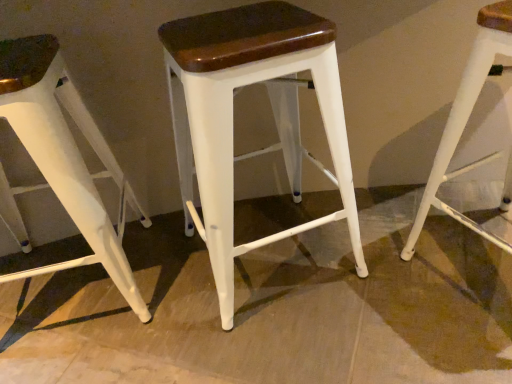
Question: Does white matte stool at center, the 2th stool from the left, contain white matte stool at left, placed as the 3th stool when sorted from right to left?

Choices:
 (A) yes
 (B) no

Answer: (B)

Question: Is the position of white matte stool at center, placed as the 2th stool when sorted from right to left, more distant than that of white matte stool at left, placed as the 3th stool when sorted from right to left?

Choices:
 (A) no
 (B) yes

Answer: (A)

Question: Is white matte stool at center, placed as the 2th stool when sorted from right to left, taller than white matte stool at left, placed as the 3th stool when sorted from right to left?

Choices:
 (A) yes
 (B) no

Answer: (B)

Question: From the image's perspective, does white matte stool at center, placed as the 2th stool when sorted from right to left, appear lower than white matte stool at left, placed as the 3th stool when sorted from right to left?

Choices:
 (A) yes
 (B) no

Answer: (B)

Question: Is white matte stool at center, the 2th stool from the left, oriented towards white matte stool at left, placed as the 3th stool when sorted from right to left?

Choices:
 (A) yes
 (B) no

Answer: (B)

Question: From the image's perspective, would you say white matte stool at center, placed as the 2th stool when sorted from right to left, is positioned over white matte stool at left, the 1th stool viewed from the left?

Choices:
 (A) yes
 (B) no

Answer: (A)

Question: From a real-world perspective, is white matte stool at center, which is the 3th stool in left-to-right order, on white matte stool at center, the 2th stool from the left?

Choices:
 (A) no
 (B) yes

Answer: (B)

Question: Is white matte stool at center, placed as the 2th stool when sorted from right to left, a part of white matte stool at center, which is the 3th stool in left-to-right order?

Choices:
 (A) no
 (B) yes

Answer: (A)

Question: Can you confirm if white matte stool at center, which is the 3th stool in left-to-right order, is smaller than white matte stool at center, the 2th stool from the left?

Choices:
 (A) yes
 (B) no

Answer: (A)

Question: From the image's perspective, does white matte stool at center, which is the 1th stool from right to left, appear higher than white matte stool at center, the 2th stool from the left?

Choices:
 (A) yes
 (B) no

Answer: (B)

Question: Is white matte stool at center, which is the 1th stool from right to left, closer to the viewer compared to white matte stool at center, placed as the 2th stool when sorted from right to left?

Choices:
 (A) yes
 (B) no

Answer: (A)

Question: Is white matte stool at center, placed as the 2th stool when sorted from right to left, at the back of white matte stool at center, which is the 3th stool in left-to-right order?

Choices:
 (A) yes
 (B) no

Answer: (B)

Question: Does white matte stool at left, placed as the 3th stool when sorted from right to left, have a smaller size compared to white matte stool at center, placed as the 2th stool when sorted from right to left?

Choices:
 (A) yes
 (B) no

Answer: (A)